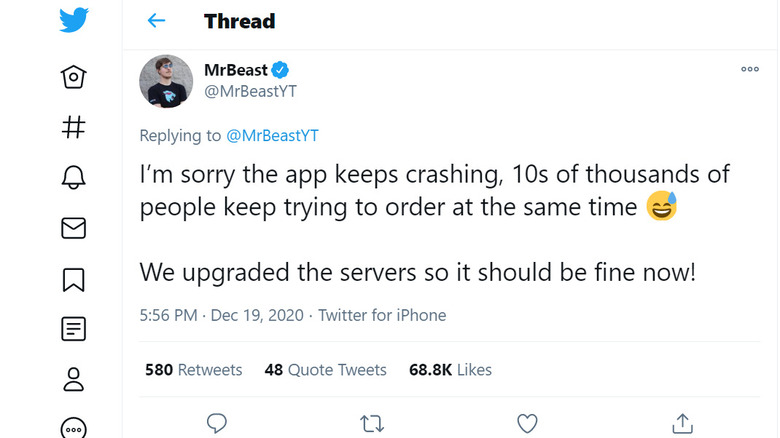
The image size is (780, 438). I want to click on circular picture, so [168, 80].